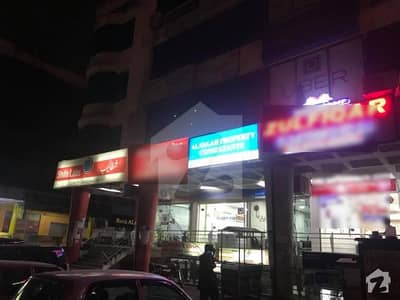
Where is `pillars`? pillars is located at coordinates (74, 221), (144, 224), (279, 227).